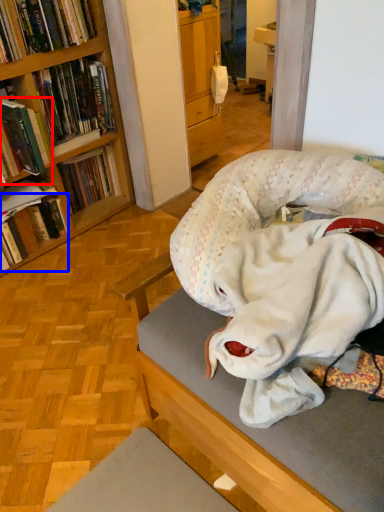
Question: Among these objects, which one is nearest to the camera, book (highlighted by a red box) or book (highlighted by a blue box)?

Choices:
 (A) book
 (B) book

Answer: (A)